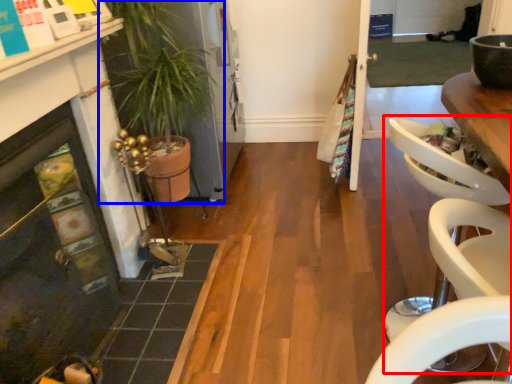
Question: Among these objects, which one is nearest to the camera, armchair (highlighted by a red box) or houseplant (highlighted by a blue box)?

Choices:
 (A) armchair
 (B) houseplant

Answer: (A)